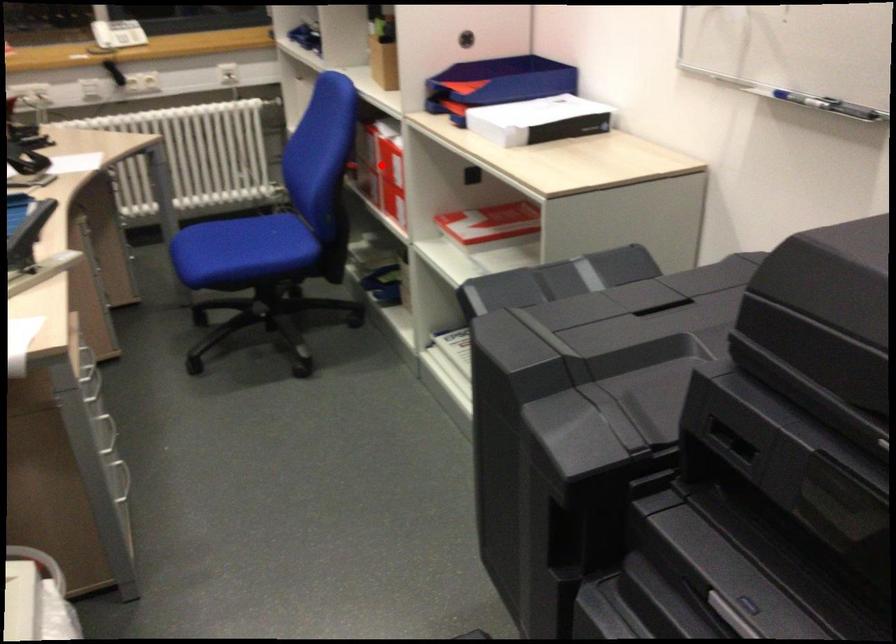
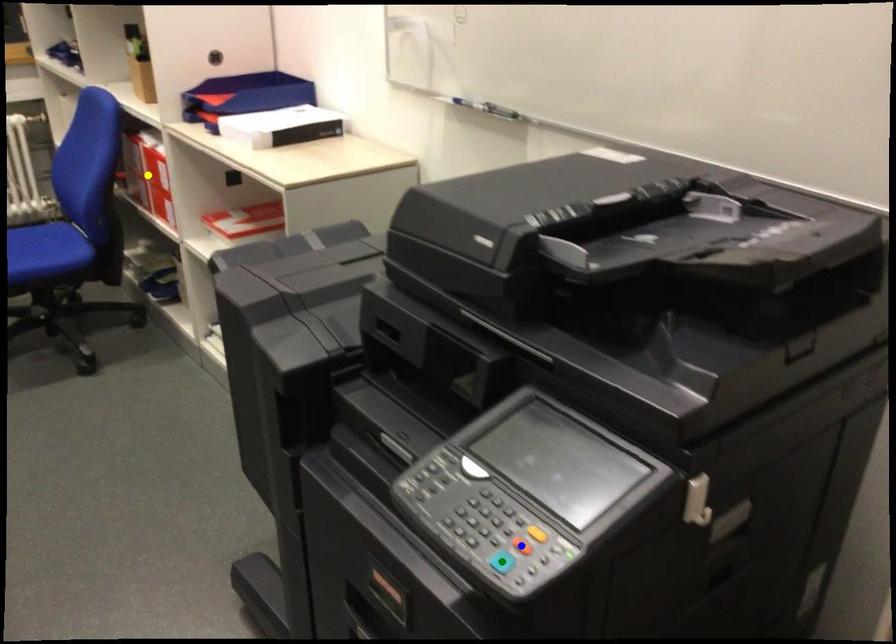
Question: I am providing you with two images of the same scene from different viewpoints. A red point is marked on the first image. You are given multiple points on the second image. Which spot in image 2 lines up with the point in image 1?

Choices:
 (A) green point
 (B) blue point
 (C) yellow point

Answer: (C)